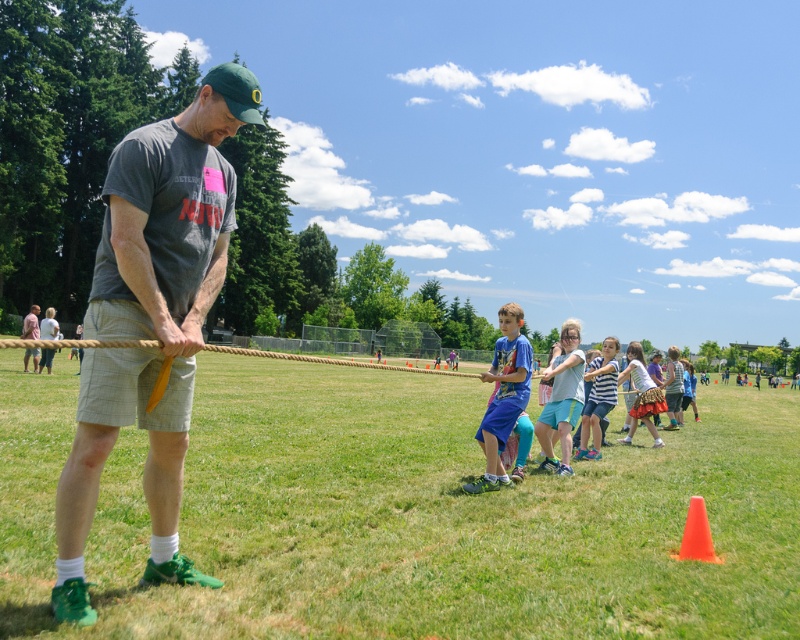
Question: Does matte gray t-shirt at center appear over striped fabric skirt at center?

Choices:
 (A) yes
 (B) no

Answer: (B)

Question: Is striped cotton shirt at center bigger than striped fabric skirt at center?

Choices:
 (A) yes
 (B) no

Answer: (B)

Question: Which point is closer to the camera?

Choices:
 (A) (574, 406)
 (B) (152, 484)

Answer: (B)

Question: Which is nearer to the light blue denim shorts at center?

Choices:
 (A) striped fabric skirt at center
 (B) striped cotton shirt at center

Answer: (B)

Question: Estimate the real-world distances between objects in this image. Which object is farther from the striped fabric skirt at center?

Choices:
 (A) striped cotton shirt at center
 (B) matte gray t-shirt at center
 (C) blue cotton shirt at center

Answer: (B)

Question: Can you confirm if blue cotton shirt at center is positioned above striped cotton shirt at center?

Choices:
 (A) yes
 (B) no

Answer: (A)